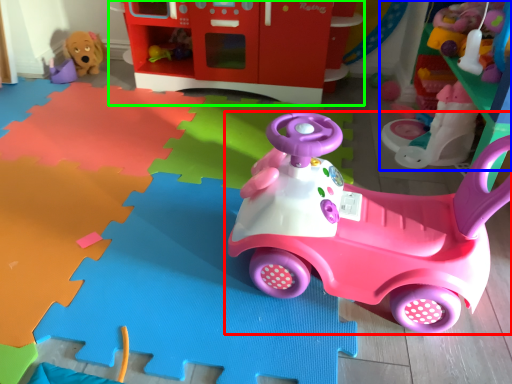
Question: Which object is the farthest from toy (highlighted by a red box)? Choose among these: toy (highlighted by a blue box) or toy (highlighted by a green box).

Choices:
 (A) toy
 (B) toy

Answer: (B)